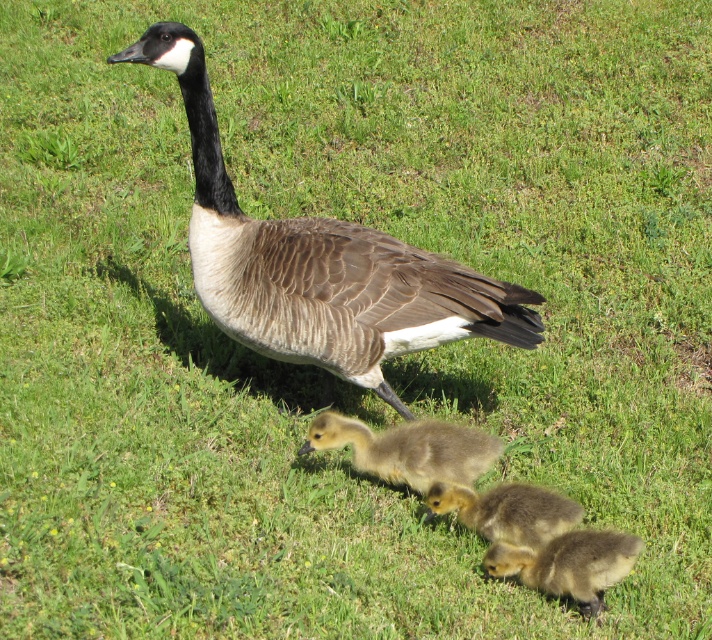
Question: Does brown textured goose at center appear under brown fuzzy gosling at center?

Choices:
 (A) yes
 (B) no

Answer: (B)

Question: Does brown textured goose at center appear under soft yellow downy gosling at center?

Choices:
 (A) no
 (B) yes

Answer: (A)

Question: Which of the following is the closest to the observer?

Choices:
 (A) (535, 580)
 (B) (256, 232)

Answer: (A)

Question: Which of the following is the farthest from the observer?

Choices:
 (A) (595, 531)
 (B) (360, 269)
 (C) (431, 445)

Answer: (B)

Question: Observing the image, what is the correct spatial positioning of soft yellow downy gosling at lower center in reference to soft yellow downy gosling at center?

Choices:
 (A) left
 (B) right

Answer: (B)

Question: Which of these objects is positioned farthest from the soft yellow downy gosling at center?

Choices:
 (A) brown fuzzy gosling at center
 (B) soft yellow downy gosling at lower center
 (C) brown textured goose at center

Answer: (C)